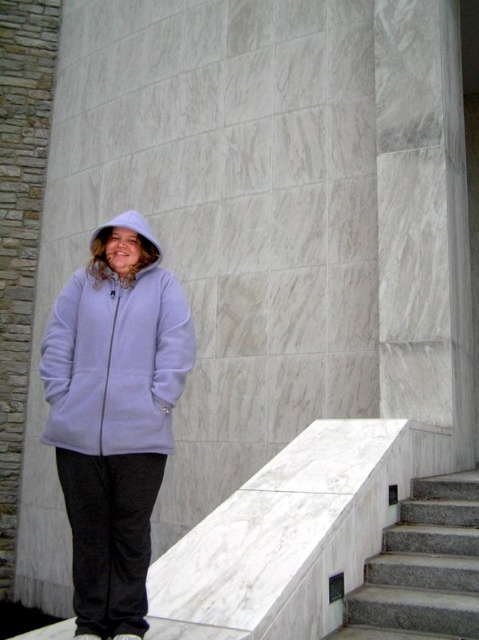
Which is below, lavender fleece jacket at center or white fleece hood at upper left?

Positioned lower is lavender fleece jacket at center.

Does lavender fleece jacket at center have a larger size compared to white fleece hood at upper left?

Correct, lavender fleece jacket at center is larger in size than white fleece hood at upper left.

Locate an element on the screen. lavender fleece jacket at center is located at coordinates (115, 362).

You are a GUI agent. You are given a task and a screenshot of the screen. Output one action in this format:
    pyautogui.click(x=<x>, y=<y>)
    Task: Click on the lavender fleece jacket at center
    
    Given the screenshot: What is the action you would take?
    pyautogui.click(x=115, y=362)

Measure the distance from purple fleece jacket at center to lavender fleece jacket at center.

The distance of purple fleece jacket at center from lavender fleece jacket at center is 2.84 inches.

Which is above, purple fleece jacket at center or lavender fleece jacket at center?

Positioned higher is lavender fleece jacket at center.

The height and width of the screenshot is (640, 479). I want to click on purple fleece jacket at center, so click(114, 416).

You are a GUI agent. You are given a task and a screenshot of the screen. Output one action in this format:
    pyautogui.click(x=<x>, y=<y>)
    Task: Click on the purple fleece jacket at center
    The width and height of the screenshot is (479, 640).
    Given the screenshot: What is the action you would take?
    pyautogui.click(x=114, y=416)

Does lavender fleece jacket at center have a lesser height compared to gray granite stairs at lower right?

No.

Does point (77, 340) come closer to viewer compared to point (421, 573)?

Yes.

Image resolution: width=479 pixels, height=640 pixels. I want to click on lavender fleece jacket at center, so click(115, 362).